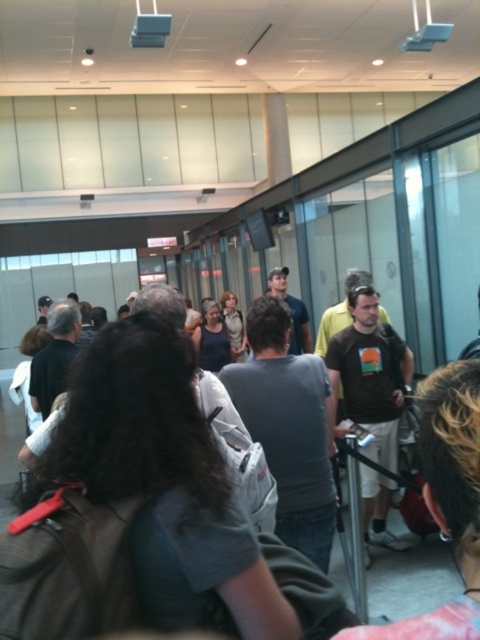
Does dark gray fabric backpack at center appear over light brown leather jacket at center?

Incorrect, dark gray fabric backpack at center is not positioned above light brown leather jacket at center.

Who is more forward, [168,486] or [225,300]?

Point [168,486]

Find the location of a particular element. This screenshot has height=640, width=480. dark gray fabric backpack at center is located at coordinates [x=164, y=480].

Can you confirm if dark gray t-shirt at center is taller than matte black shirt at center?

Indeed, dark gray t-shirt at center has a greater height compared to matte black shirt at center.

Between point (300, 380) and point (202, 368), which one is positioned behind?

Point (202, 368)

The width and height of the screenshot is (480, 640). What are the coordinates of `dark gray t-shirt at center` in the screenshot? It's located at (288, 426).

Measure the distance from dark gray t-shirt at center to light brown leather jacket at center.

dark gray t-shirt at center and light brown leather jacket at center are 4.23 meters apart.

Who is shorter, dark gray t-shirt at center or light brown leather jacket at center?

Standing shorter between the two is light brown leather jacket at center.

Is point (325, 570) closer to camera compared to point (238, 344)?

Yes.

This screenshot has height=640, width=480. In order to click on dark gray t-shirt at center in this screenshot , I will do `click(288, 426)`.